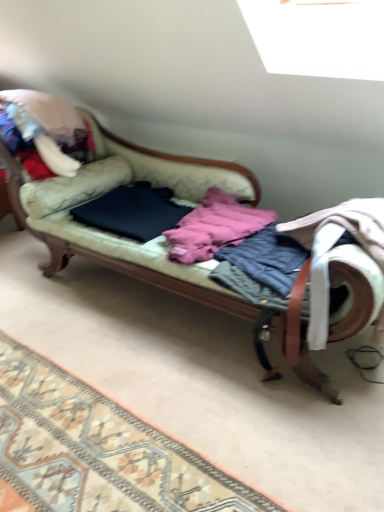
Measure the distance between pink fleece jacket at center, the 2th clothing positioned from the left, and camera.

1.72 meters.

The height and width of the screenshot is (512, 384). What do you see at coordinates (98, 449) in the screenshot?
I see `patterned carpet at lower left` at bounding box center [98, 449].

This screenshot has width=384, height=512. What do you see at coordinates (121, 255) in the screenshot?
I see `velvet green couch at center` at bounding box center [121, 255].

This screenshot has width=384, height=512. I want to click on dark blue fabric at center, the third clothing when ordered from right to left, so click(x=133, y=211).

Looking at the image, does dark blue fabric at center, the third clothing when ordered from right to left, seem bigger or smaller compared to patterned carpet at lower left?

Clearly, dark blue fabric at center, the third clothing when ordered from right to left, is larger in size than patterned carpet at lower left.

Is dark blue fabric at center, the third clothing when ordered from right to left, thinner than patterned carpet at lower left?

Yes, dark blue fabric at center, the third clothing when ordered from right to left, is thinner than patterned carpet at lower left.

Which object is positioned more to the left, dark blue fabric at center, positioned as the first clothing in left-to-right order, or patterned carpet at lower left?

From the viewer's perspective, patterned carpet at lower left appears more on the left side.

Locate an element on the screen. The image size is (384, 512). mat lying in front of the dark blue fabric at center, the third clothing when ordered from right to left is located at coordinates (98, 449).

From the image's perspective, is pink fleece jacket at center, marked as the second clothing in a right-to-left arrangement, below velvet green couch at center?

Yes, from the image's perspective, pink fleece jacket at center, marked as the second clothing in a right-to-left arrangement, is beneath velvet green couch at center.

Is the depth of pink fleece jacket at center, marked as the second clothing in a right-to-left arrangement, less than that of velvet green couch at center?

No, pink fleece jacket at center, marked as the second clothing in a right-to-left arrangement, is further to the viewer.

Can you tell me how much pink fleece jacket at center, marked as the second clothing in a right-to-left arrangement, and velvet green couch at center differ in facing direction?

There is a 0.000313-degree angle between the facing directions of pink fleece jacket at center, marked as the second clothing in a right-to-left arrangement, and velvet green couch at center.

Between pink fleece jacket at center, the 2th clothing positioned from the left, and velvet green couch at center, which one has smaller size?

pink fleece jacket at center, the 2th clothing positioned from the left.

Is pink fleece jacket at center, the 2th clothing positioned from the left, at the left side of dark blue fabric at center, the third clothing when ordered from right to left?

No, pink fleece jacket at center, the 2th clothing positioned from the left, is not to the left of dark blue fabric at center, the third clothing when ordered from right to left.

Considering the sizes of objects pink fleece jacket at center, the 2th clothing positioned from the left, and dark blue fabric at center, the third clothing when ordered from right to left, in the image provided, who is thinner, pink fleece jacket at center, the 2th clothing positioned from the left, or dark blue fabric at center, the third clothing when ordered from right to left,?

dark blue fabric at center, the third clothing when ordered from right to left, is thinner.

From the image's perspective, is pink fleece jacket at center, the 2th clothing positioned from the left, over dark blue fabric at center, the third clothing when ordered from right to left?

No, from the image's perspective, pink fleece jacket at center, the 2th clothing positioned from the left, is not above dark blue fabric at center, the third clothing when ordered from right to left.

Which point is more distant from viewer, (208, 236) or (146, 206)?

Point (146, 206)

From a real-world perspective, does patterned carpet at lower left stand above pink fleece jacket at center, marked as the second clothing in a right-to-left arrangement?

Actually, patterned carpet at lower left is physically below pink fleece jacket at center, marked as the second clothing in a right-to-left arrangement, in the real world.

Can you see patterned carpet at lower left touching pink fleece jacket at center, the 2th clothing positioned from the left?

There is a gap between patterned carpet at lower left and pink fleece jacket at center, the 2th clothing positioned from the left.

Where is `mat directly beneath the pink fleece jacket at center, marked as the second clothing in a right-to-left arrangement (from a real-world perspective)`? The height and width of the screenshot is (512, 384). mat directly beneath the pink fleece jacket at center, marked as the second clothing in a right-to-left arrangement (from a real-world perspective) is located at coordinates (98, 449).

From a real-world perspective, who is located higher, blue quilted jacket at center, the third clothing when ordered from left to right, or velvet green couch at center?

blue quilted jacket at center, the third clothing when ordered from left to right.

Considering the sizes of objects blue quilted jacket at center, the third clothing when ordered from left to right, and velvet green couch at center in the image provided, who is thinner, blue quilted jacket at center, the third clothing when ordered from left to right, or velvet green couch at center?

blue quilted jacket at center, the third clothing when ordered from left to right, is thinner.

Is blue quilted jacket at center, the third clothing when ordered from left to right, facing away from velvet green couch at center?

Yes, velvet green couch at center is at the back of blue quilted jacket at center, the third clothing when ordered from left to right.

Can you tell me how much blue quilted jacket at center, the third clothing when ordered from left to right, and velvet green couch at center differ in facing direction?

0.000243 degrees separate the facing orientations of blue quilted jacket at center, the third clothing when ordered from left to right, and velvet green couch at center.

Which point is more forward, (x=194, y=251) or (x=248, y=264)?

The point (x=248, y=264) is more forward.

Which object is thinner, pink fleece jacket at center, the 2th clothing positioned from the left, or blue quilted jacket at center, the first clothing viewed from the right?

With smaller width is blue quilted jacket at center, the first clothing viewed from the right.

From a real-world perspective, is pink fleece jacket at center, the 2th clothing positioned from the left, above or below blue quilted jacket at center, the third clothing when ordered from left to right?

In terms of real-world spatial position, pink fleece jacket at center, the 2th clothing positioned from the left, is above blue quilted jacket at center, the third clothing when ordered from left to right.

Does blue quilted jacket at center, the first clothing viewed from the right, appear on the right side of patterned carpet at lower left?

Correct, you'll find blue quilted jacket at center, the first clothing viewed from the right, to the right of patterned carpet at lower left.

Is blue quilted jacket at center, the first clothing viewed from the right, next to patterned carpet at lower left and touching it?

No.

Can you confirm if blue quilted jacket at center, the first clothing viewed from the right, is wider than patterned carpet at lower left?

No.

In order to click on mat below the dark blue fabric at center, the third clothing when ordered from right to left (from the image's perspective) in this screenshot , I will do `click(98, 449)`.

This screenshot has height=512, width=384. I want to click on studio couch on the left of the pink fleece jacket at center, the 2th clothing positioned from the left, so click(x=121, y=255).

Considering their positions, is pink fleece jacket at center, marked as the second clothing in a right-to-left arrangement, positioned further to dark blue fabric at center, the third clothing when ordered from right to left, than patterned carpet at lower left?

The object further to dark blue fabric at center, the third clothing when ordered from right to left, is patterned carpet at lower left.

From the image, which object appears to be farther from pink fleece jacket at center, marked as the second clothing in a right-to-left arrangement, dark blue fabric at center, positioned as the first clothing in left-to-right order, or blue quilted jacket at center, the third clothing when ordered from left to right?

dark blue fabric at center, positioned as the first clothing in left-to-right order, is further to pink fleece jacket at center, marked as the second clothing in a right-to-left arrangement.

Estimate the real-world distances between objects in this image. Which object is further from dark blue fabric at center, the third clothing when ordered from right to left, patterned carpet at lower left or blue quilted jacket at center, the third clothing when ordered from left to right?

patterned carpet at lower left.

Looking at this image, which object lies further to the anchor point dark blue fabric at center, positioned as the first clothing in left-to-right order, blue quilted jacket at center, the first clothing viewed from the right, or velvet green couch at center?

Among the two, blue quilted jacket at center, the first clothing viewed from the right, is located further to dark blue fabric at center, positioned as the first clothing in left-to-right order.

Which object lies nearer to the anchor point pink fleece jacket at center, marked as the second clothing in a right-to-left arrangement, patterned carpet at lower left or dark blue fabric at center, the third clothing when ordered from right to left?

Based on the image, dark blue fabric at center, the third clothing when ordered from right to left, appears to be nearer to pink fleece jacket at center, marked as the second clothing in a right-to-left arrangement.

Looking at the image, which one is located closer to patterned carpet at lower left, velvet green couch at center or pink fleece jacket at center, the 2th clothing positioned from the left?

Among the two, velvet green couch at center is located nearer to patterned carpet at lower left.

Based on their spatial positions, is velvet green couch at center or dark blue fabric at center, positioned as the first clothing in left-to-right order, closer to patterned carpet at lower left?

velvet green couch at center is closer to patterned carpet at lower left.

Based on their spatial positions, is pink fleece jacket at center, the 2th clothing positioned from the left, or blue quilted jacket at center, the first clothing viewed from the right, further from dark blue fabric at center, positioned as the first clothing in left-to-right order?

blue quilted jacket at center, the first clothing viewed from the right, lies further to dark blue fabric at center, positioned as the first clothing in left-to-right order, than the other object.

The height and width of the screenshot is (512, 384). Find the location of `clothing between pink fleece jacket at center, marked as the second clothing in a right-to-left arrangement, and patterned carpet at lower left, in the vertical direction`. clothing between pink fleece jacket at center, marked as the second clothing in a right-to-left arrangement, and patterned carpet at lower left, in the vertical direction is located at coordinates (267, 258).

Where is `clothing situated between velvet green couch at center and blue quilted jacket at center, the third clothing when ordered from left to right, from left to right`? clothing situated between velvet green couch at center and blue quilted jacket at center, the third clothing when ordered from left to right, from left to right is located at coordinates (214, 227).

Where is `studio couch between dark blue fabric at center, positioned as the first clothing in left-to-right order, and patterned carpet at lower left from top to bottom`? This screenshot has width=384, height=512. studio couch between dark blue fabric at center, positioned as the first clothing in left-to-right order, and patterned carpet at lower left from top to bottom is located at coordinates (121, 255).

Find the location of a particular element. clothing situated between dark blue fabric at center, the third clothing when ordered from right to left, and blue quilted jacket at center, the first clothing viewed from the right, from left to right is located at coordinates (214, 227).